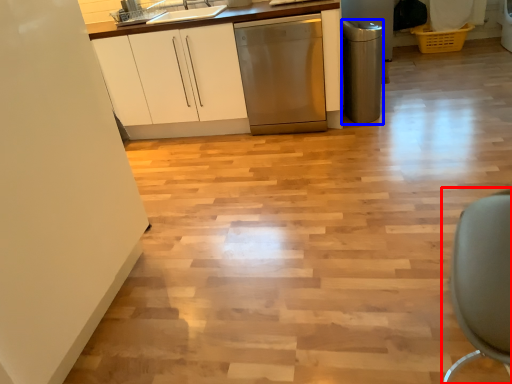
Question: Which point is further to the camera, swivel chair (highlighted by a red box) or appliance (highlighted by a blue box)?

Choices:
 (A) swivel chair
 (B) appliance

Answer: (B)